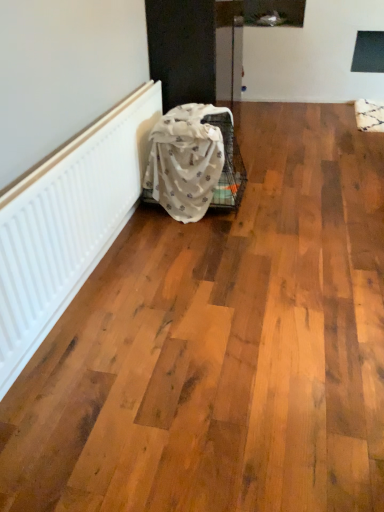
Find the location of a particular element. The width and height of the screenshot is (384, 512). empty space that is ontop of white textured radiator at left (from a real-world perspective) is located at coordinates (89, 131).